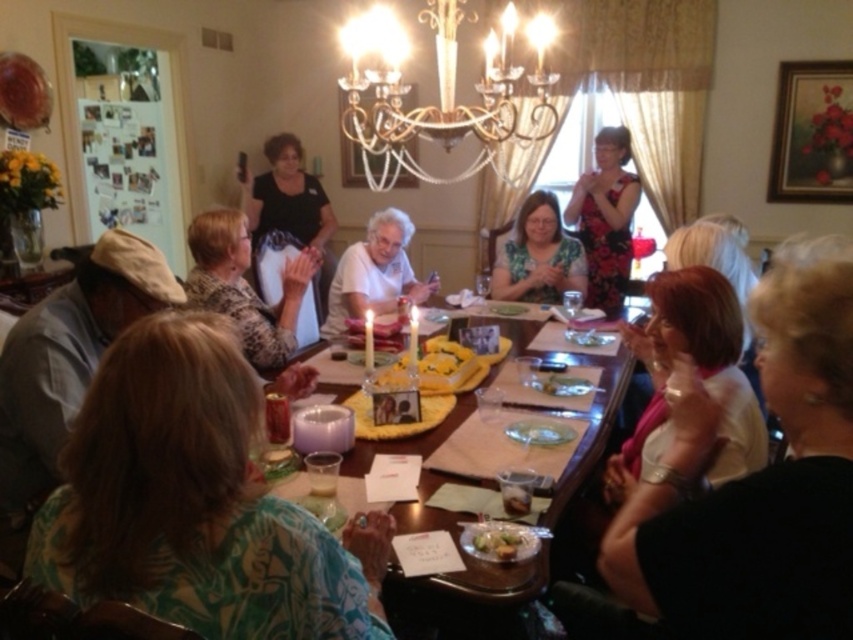
Question: Which of the following is the farthest from the observer?

Choices:
 (A) (238, 310)
 (B) (439, 8)
 (C) (830, 611)
 (D) (503, 285)

Answer: (D)

Question: Is matte white blouse at lower right positioned at the back of green leafy salad at center?

Choices:
 (A) no
 (B) yes

Answer: (A)

Question: Which object appears farthest from the camera in this image?

Choices:
 (A) green floral dress at center
 (B) leopard print blouse at left
 (C) floral dress at upper right
 (D) green floral shirt at lower left

Answer: (C)

Question: Does floral dress at upper right have a lesser width compared to green floral dress at center?

Choices:
 (A) yes
 (B) no

Answer: (A)

Question: Can you confirm if green floral shirt at lower left is positioned below green leafy salad at center?

Choices:
 (A) yes
 (B) no

Answer: (B)

Question: Estimate the real-world distances between objects in this image. Which object is closer to the floral dress at upper right?

Choices:
 (A) green floral shirt at lower left
 (B) gold crystal chandelier at upper center
 (C) green floral dress at center
 (D) leopard print blouse at left

Answer: (C)